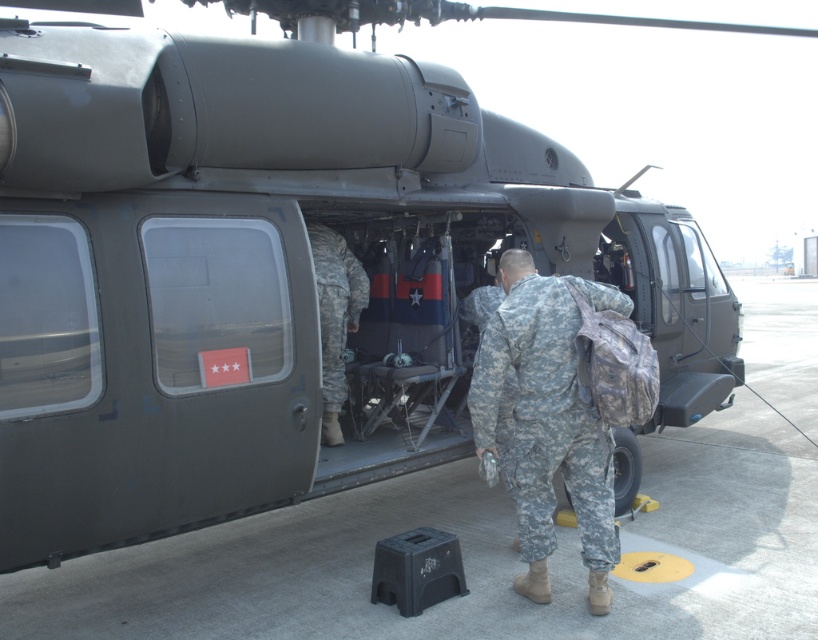
You are a photographer trying to capture a clear photo of both the camouflage fabric soldier at center and the camouflage uniform at center in the image. Since you can only focus on one subject at a time, which one should you adjust your camera to focus on first if you want to ensure the other is still somewhat in the frame?

You should focus on the camouflage fabric soldier at center first because it is positioned on the right side of the camouflage uniform at center, so adjusting focus on the soldier would keep the uniform in the frame as well.

You are a military technician standing at point (327, 269). You need to reach point (506, 429) to inspect a component. Is the point you need to reach located in front of or behind you?

The point (506, 429) is in front of point (327, 269), so the technician should move forward to reach it.

You are a military observer analyzing the scene. There is a camouflage fabric soldier at center and a camouflage uniform at center. Which one is taller?

The camouflage fabric soldier at center is much taller than the camouflage uniform at center.